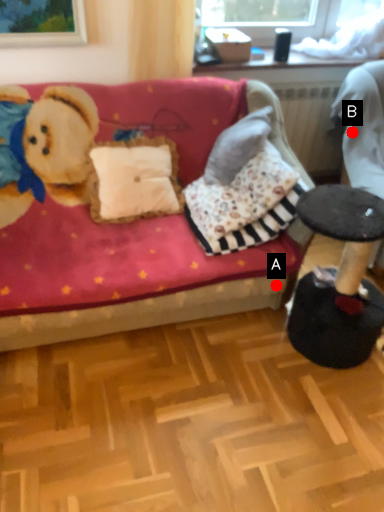
Question: Two points are circled on the image, labeled by A and B beside each circle. Which point is farther from the camera taking this photo?

Choices:
 (A) A is further
 (B) B is further

Answer: (B)